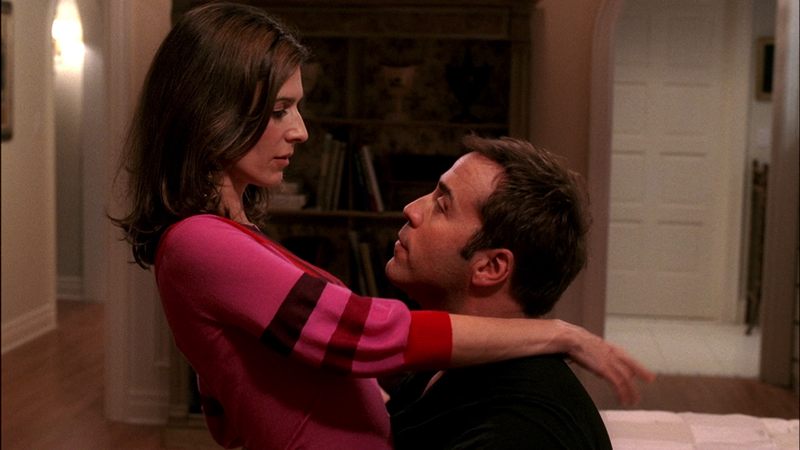
I want to click on books, so click(322, 172), click(330, 175), click(336, 162), click(370, 171), click(369, 267), click(354, 250).